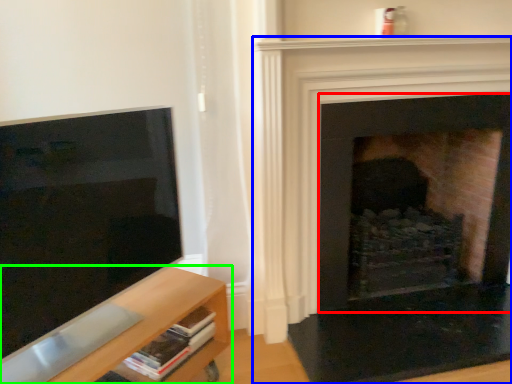
Question: Which object is the closest to the fireplace (highlighted by a red box)? Choose among these: fireplace (highlighted by a blue box) or shelf (highlighted by a green box).

Choices:
 (A) fireplace
 (B) shelf

Answer: (A)